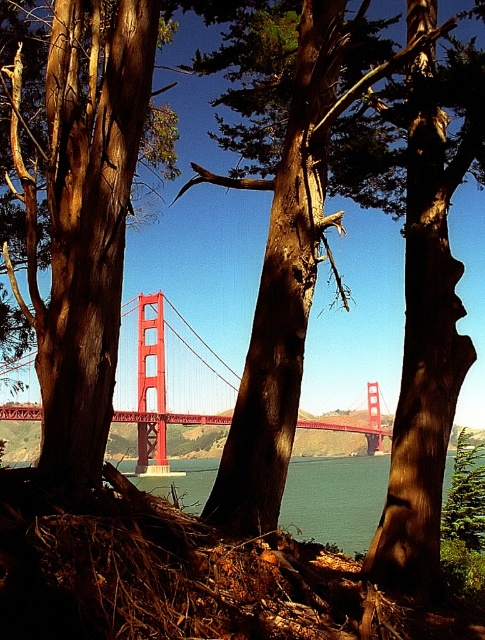
Question: Estimate the real-world distances between objects in this image. Which object is closer to the smooth brown tree trunk at center?

Choices:
 (A) red painted steel bridge at center
 (B) transparent water at center

Answer: (B)

Question: Can you confirm if smooth brown tree trunk at center is smaller than transparent water at center?

Choices:
 (A) yes
 (B) no

Answer: (A)

Question: Is red painted steel bridge at center wider than transparent water at center?

Choices:
 (A) yes
 (B) no

Answer: (A)

Question: Can you confirm if smooth brown tree trunk at center is bigger than transparent water at center?

Choices:
 (A) no
 (B) yes

Answer: (A)

Question: Which object is positioned farthest from the smooth brown tree trunk at center?

Choices:
 (A) transparent water at center
 (B) red painted steel bridge at center

Answer: (B)

Question: Which is farther from the smooth brown tree trunk at center?

Choices:
 (A) red painted steel bridge at center
 (B) transparent water at center

Answer: (A)